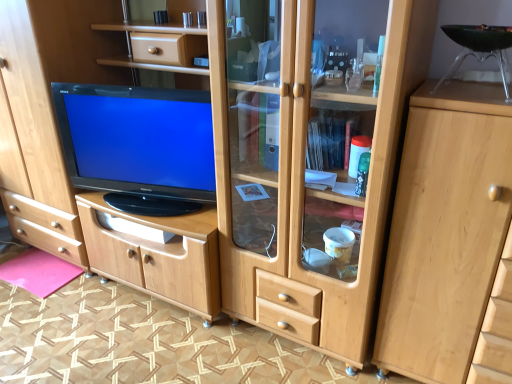
The width and height of the screenshot is (512, 384). I want to click on empty space that is ontop of pink felt mat at lower left (from a real-world perspective), so click(35, 268).